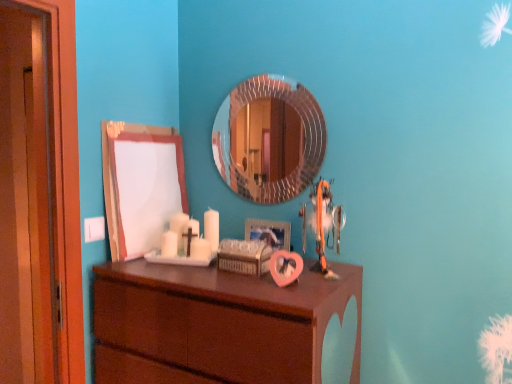
Question: From a real-world perspective, relative to brown wood chest of drawers at center, is white matte board at upper left, which ranks as the second mirror in right-to-left order, vertically above or below?

Choices:
 (A) below
 (B) above

Answer: (B)

Question: Is white matte board at upper left, which is the first mirror from left to right, inside or outside of brown wood chest of drawers at center?

Choices:
 (A) outside
 (B) inside

Answer: (A)

Question: Considering the real-world distances, which object is closest to the wooden picture frame at center?

Choices:
 (A) brown wood chest of drawers at center
 (B) rounded silver mirror at center, the second mirror positioned from the left
 (C) white matte board at upper left, which ranks as the second mirror in right-to-left order
 (D) orange fabric toy at center

Answer: (D)

Question: Estimate the real-world distances between objects in this image. Which object is closer to the brown wood chest of drawers at center?

Choices:
 (A) white matte board at upper left, which ranks as the second mirror in right-to-left order
 (B) rounded silver mirror at center, the second mirror positioned from the left
 (C) wooden picture frame at center
 (D) orange fabric toy at center

Answer: (D)